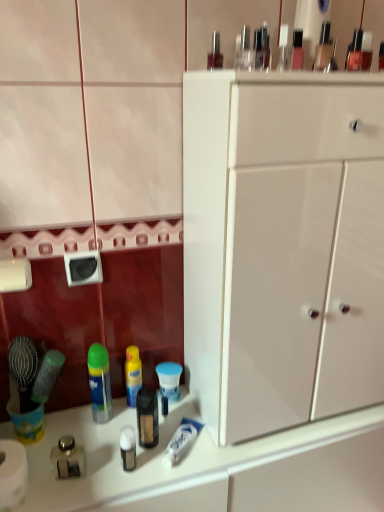
The image size is (384, 512). In order to click on vacant space to the left of green plastic mouthwash at center in this screenshot , I will do `click(69, 423)`.